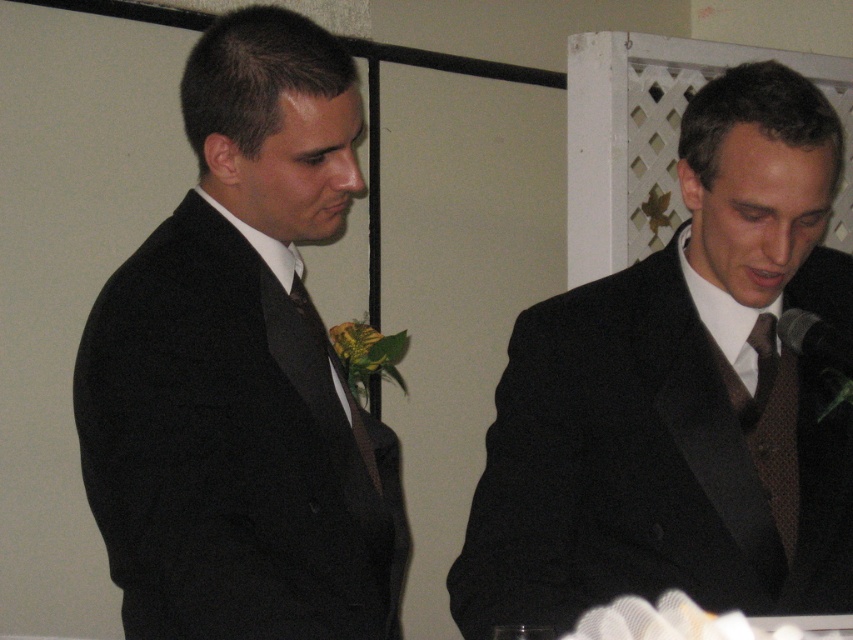
Question: Which of the following is the closest to the observer?

Choices:
 (A) black textured microphone at right
 (B) brown satin tie at left

Answer: (A)

Question: Is black textured microphone at right thinner than brown satin tie at left?

Choices:
 (A) yes
 (B) no

Answer: (A)

Question: Which point is closer to the camera?

Choices:
 (A) (756, 387)
 (B) (341, 384)
 (C) (814, 346)

Answer: (C)

Question: Which of these objects is positioned closest to the black textured microphone at right?

Choices:
 (A) black textured suit at center
 (B) brown satin tie at left
 (C) matte black suit at left

Answer: (A)

Question: Does matte black suit at left have a greater width compared to brown satin tie at left?

Choices:
 (A) no
 (B) yes

Answer: (B)

Question: Can you confirm if matte black suit at left is wider than black textured microphone at right?

Choices:
 (A) no
 (B) yes

Answer: (B)